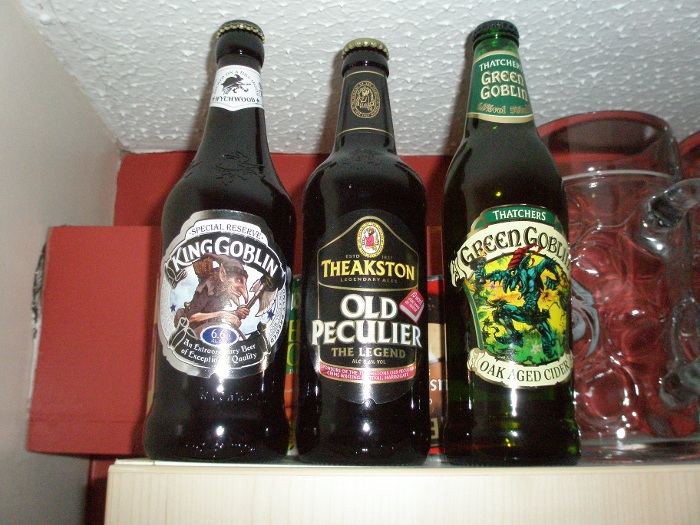
Where is `handle`? handle is located at coordinates (690, 202).